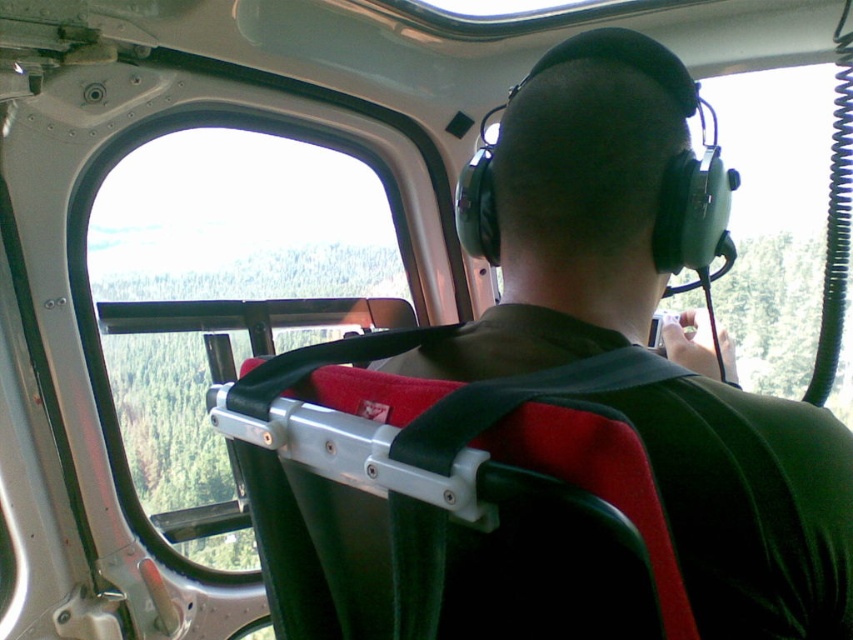
In the scene shown: Can you confirm if transparent glass window at upper left is positioned to the left of green fabric strap at center?

Yes, transparent glass window at upper left is to the left of green fabric strap at center.

Is transparent glass window at upper left below green fabric strap at center?

No.

Locate an element on the screen. This screenshot has width=853, height=640. transparent glass window at upper left is located at coordinates (225, 275).